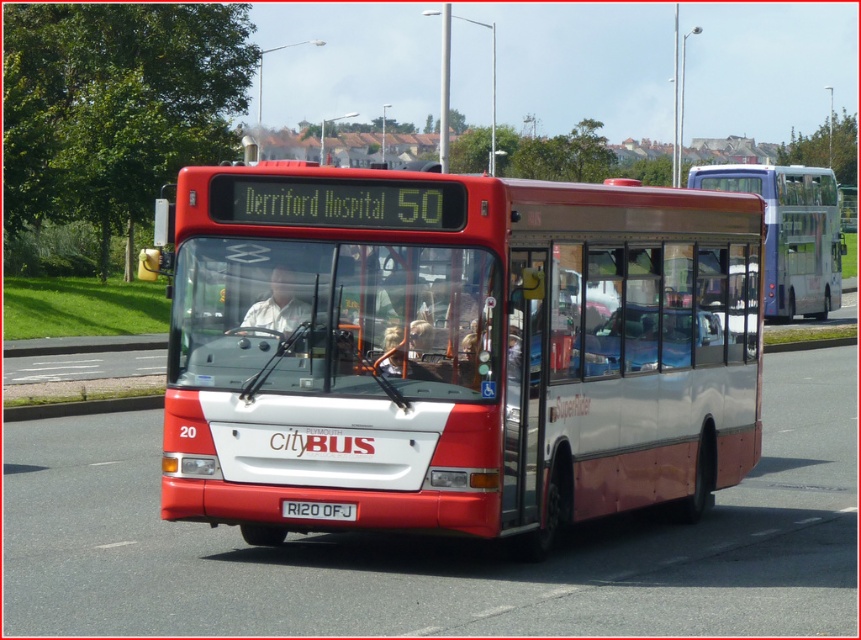
Question: Which point appears farthest from the camera in this image?

Choices:
 (A) (255, 330)
 (B) (686, 180)

Answer: (B)

Question: Is matte red bus at center wider than matte white shirt at center?

Choices:
 (A) no
 (B) yes

Answer: (B)

Question: Among these objects, which one is farthest from the camera?

Choices:
 (A) matte red bus at center
 (B) metallic silver bus at center

Answer: (B)

Question: Is matte red bus at center positioned in front of metallic silver bus at center?

Choices:
 (A) no
 (B) yes

Answer: (B)

Question: Does matte red bus at center appear on the right side of white plastic license plate at center?

Choices:
 (A) no
 (B) yes

Answer: (B)

Question: Which of the following is the closest to the observer?

Choices:
 (A) (782, 227)
 (B) (277, 266)
 (C) (329, 516)

Answer: (C)